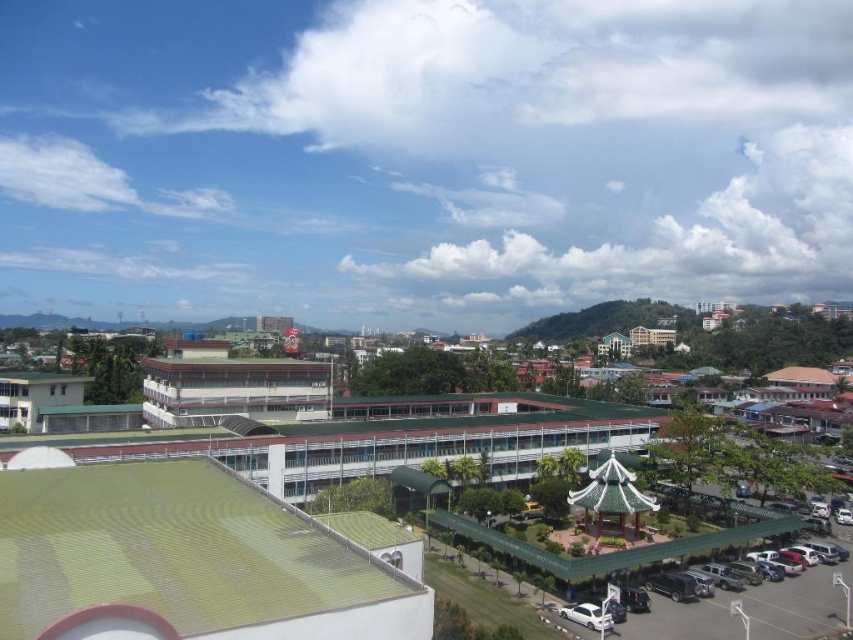
You are standing at the viewpoint where the image was taken and want to walk towards the point labeled as point (x=21, y=516). Will you pass by the point labeled as point (x=164, y=404) on your way?

Yes, because point (x=21, y=516) is in front of point (x=164, y=404), so you will pass by point (x=164, y=404) on your way to point (x=21, y=516).

You are standing in the parking lot and looking towards the buildings. Which building is positioned higher in your field of view, the white matte building at center or the green matte building at left?

The white matte building at center is positioned higher in your field of view than the green matte building at left because it is above it.

You are standing in the parking lot and see two points marked in the image. Which point, point (323,412) or point (79,381), is closer to you?

Point (323,412) is closer to the viewer than point (79,381).